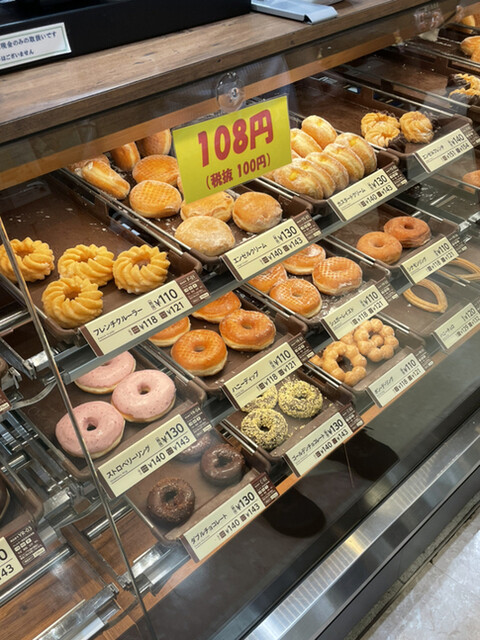
The width and height of the screenshot is (480, 640). Identify the location of grey cement floor. (235, 566).